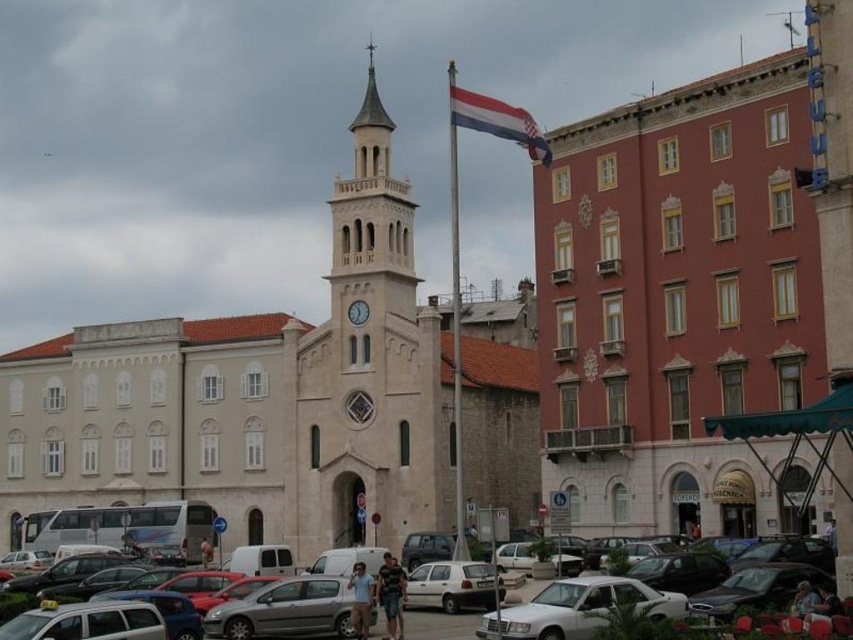
Question: Does white stone clock tower at center appear under silver metallic hatchback at center?

Choices:
 (A) no
 (B) yes

Answer: (A)

Question: Among these objects, which one is nearest to the camera?

Choices:
 (A) metallic gray cars at lower center
 (B) white matte hatchback at center

Answer: (A)

Question: From the image, what is the correct spatial relationship of white stone clock tower at center in relation to metallic gray cars at lower center?

Choices:
 (A) right
 (B) left

Answer: (B)

Question: Considering the real-world distances, which object is closest to the silver metallic hatchback at center?

Choices:
 (A) metallic gray cars at lower center
 (B) white matte hatchback at center
 (C) white stone clock tower at center
 (D) matte pink building at right

Answer: (A)

Question: Where is metallic gray cars at lower center located in relation to red and white striped flag at center in the image?

Choices:
 (A) below
 (B) above

Answer: (A)

Question: Which object is positioned farthest from the silver metallic hatchback at center?

Choices:
 (A) white glossy sedan at center
 (B) white matte hatchback at center
 (C) red and white striped flag at center
 (D) matte pink building at right

Answer: (C)